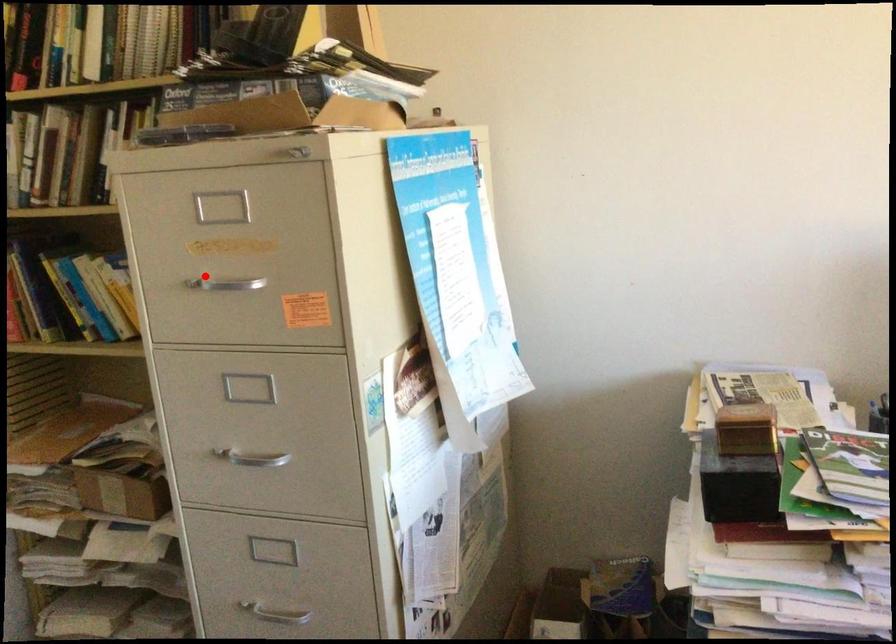
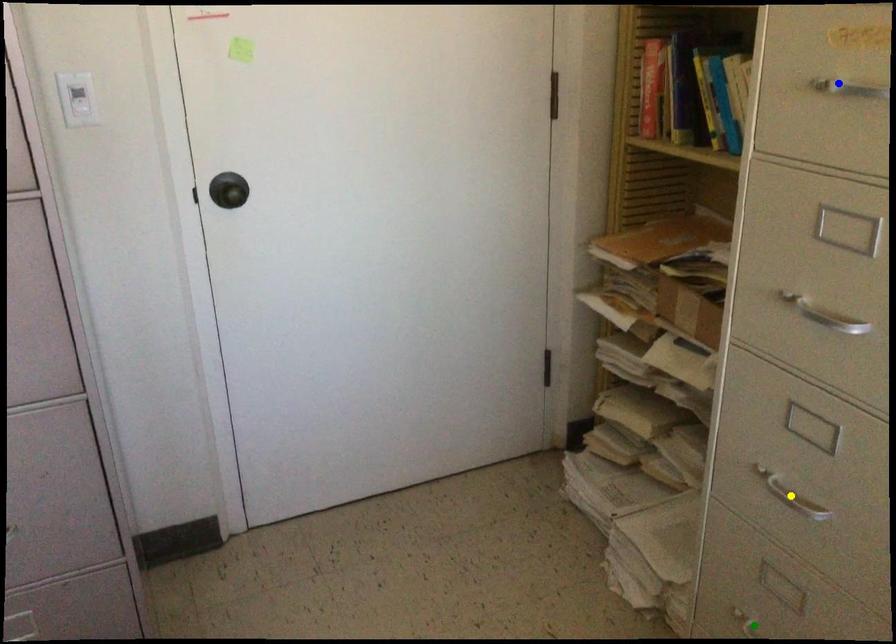
Question: I am providing you with two images of the same scene from different viewpoints. A red point is marked on the first image. You are given multiple points on the second image. Can you choose the point in image 2 that corresponds to the point in image 1?

Choices:
 (A) blue point
 (B) yellow point
 (C) green point

Answer: (A)